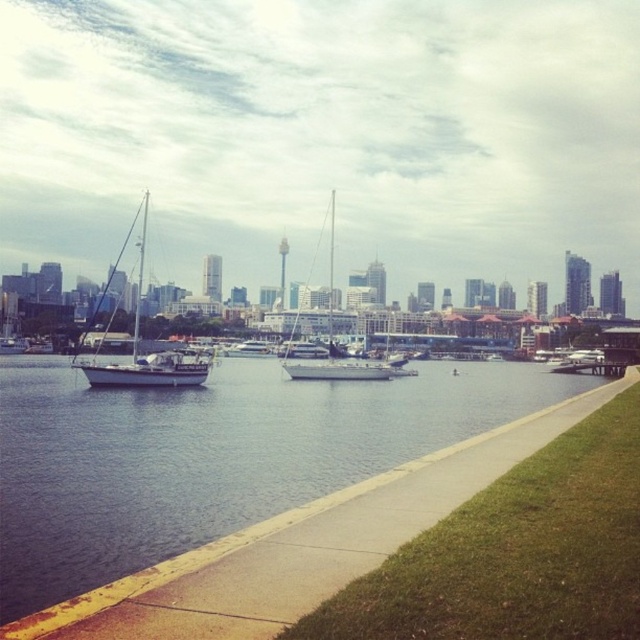
Does concrete sidewalk at lower center have a lesser width compared to white glossy sailboat at left?

Yes.

Between concrete sidewalk at lower center and white glossy sailboat at left, which one is positioned higher?

white glossy sailboat at left is higher up.

Is point (156, 627) in front of point (125, 378)?

Yes, it is.

What are the coordinates of `concrete sidewalk at lower center` in the screenshot? It's located at (301, 545).

Describe the element at coordinates (147, 353) in the screenshot. I see `white glossy sailboat at left` at that location.

Identify the location of white glossy sailboat at left. This screenshot has width=640, height=640. (147, 353).

Is point (147, 369) closer to viewer compared to point (397, 365)?

Yes, point (147, 369) is closer to viewer.

Consider the image. Is white glossy sailboat at left wider than white matte boat at center?

Indeed, white glossy sailboat at left has a greater width compared to white matte boat at center.

Locate an element on the screen. white glossy sailboat at left is located at coordinates (147, 353).